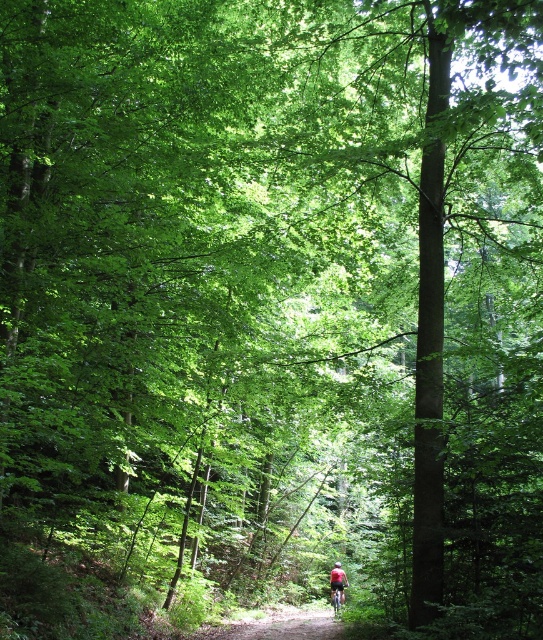
Based on the photo, which is more to the left, dirt path at center or red fabric mountain biker at center?

Positioned to the left is dirt path at center.

Does dirt path at center appear on the left side of red fabric mountain biker at center?

Correct, you'll find dirt path at center to the left of red fabric mountain biker at center.

Who is more forward, (230, 637) or (333, 602)?

Positioned in front is point (230, 637).

At what (x,y) coordinates should I click in order to perform the action: click on dirt path at center. Please return your answer as a coordinate pair (x, y). This screenshot has width=543, height=640. Looking at the image, I should click on (285, 625).

Does dirt path at center have a lesser height compared to red fabric cyclist at center?

Incorrect, dirt path at center's height does not fall short of red fabric cyclist at center's.

Is the position of dirt path at center more distant than that of red fabric cyclist at center?

No.

What do you see at coordinates (285, 625) in the screenshot? I see `dirt path at center` at bounding box center [285, 625].

This screenshot has height=640, width=543. What are the coordinates of `dirt path at center` in the screenshot? It's located at (285, 625).

Is dirt path at center taller than shiny metallic bicycle at center?

Indeed, dirt path at center has a greater height compared to shiny metallic bicycle at center.

Is dirt path at center positioned at the back of shiny metallic bicycle at center?

No, dirt path at center is in front of shiny metallic bicycle at center.

This screenshot has height=640, width=543. What do you see at coordinates (285, 625) in the screenshot? I see `dirt path at center` at bounding box center [285, 625].

The height and width of the screenshot is (640, 543). Identify the location of dirt path at center. (285, 625).